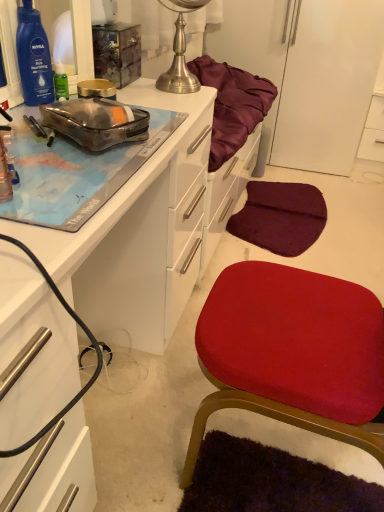
Question: Does white glossy cabinet at upper right, which is counted as the first cabinetry, starting from the back, turn towards matte white desk at upper left, the 1th cabinetry when ordered from bottom to top?

Choices:
 (A) yes
 (B) no

Answer: (B)

Question: From a real-world perspective, is white glossy cabinet at upper right, which is counted as the first cabinetry, starting from the back, on matte white desk at upper left, the second cabinetry from the right?

Choices:
 (A) no
 (B) yes

Answer: (A)

Question: Does white glossy cabinet at upper right, which is counted as the first cabinetry, starting from the back, have a greater width compared to matte white desk at upper left, the first cabinetry from the left?

Choices:
 (A) yes
 (B) no

Answer: (B)

Question: Can you confirm if white glossy cabinet at upper right, marked as the 1th cabinetry in a right-to-left arrangement, is taller than matte white desk at upper left, which is the 2th cabinetry in top-to-bottom order?

Choices:
 (A) no
 (B) yes

Answer: (A)

Question: Can you confirm if white glossy cabinet at upper right, which is counted as the first cabinetry, starting from the back, is bigger than matte white desk at upper left, the first cabinetry from the left?

Choices:
 (A) no
 (B) yes

Answer: (A)

Question: Based on their sizes in the image, would you say white glossy cabinet at upper right, the first cabinetry when ordered from top to bottom, is bigger or smaller than matte white desk at upper left, the 1th cabinetry when ordered from bottom to top?

Choices:
 (A) big
 (B) small

Answer: (B)

Question: From the image's perspective, is white glossy cabinet at upper right, which is counted as the 2th cabinetry, starting from the bottom, above or below matte white desk at upper left, which is the 2th cabinetry in top-to-bottom order?

Choices:
 (A) above
 (B) below

Answer: (A)

Question: Is white glossy cabinet at upper right, positioned as the second cabinetry in front-to-back order, wider or thinner than matte white desk at upper left, the 1th cabinetry when ordered from bottom to top?

Choices:
 (A) wide
 (B) thin

Answer: (B)

Question: Considering the positions of white glossy cabinet at upper right, positioned as the 2th cabinetry in left-to-right order, and matte white desk at upper left, which is the 2th cabinetry in back-to-front order, in the image, is white glossy cabinet at upper right, positioned as the 2th cabinetry in left-to-right order, taller or shorter than matte white desk at upper left, which is the 2th cabinetry in back-to-front order,?

Choices:
 (A) short
 (B) tall

Answer: (A)

Question: Is transparent plastic pouch at upper left to the left or to the right of matte white desk at upper left, the second cabinetry from the right, in the image?

Choices:
 (A) left
 (B) right

Answer: (B)

Question: Is transparent plastic pouch at upper left spatially inside matte white desk at upper left, which is the 2th cabinetry in top-to-bottom order, or outside of it?

Choices:
 (A) inside
 (B) outside

Answer: (B)

Question: Does point (76, 109) appear closer or farther from the camera than point (51, 486)?

Choices:
 (A) farther
 (B) closer

Answer: (A)

Question: Considering their positions, is transparent plastic pouch at upper left located in front of or behind matte white desk at upper left, which is counted as the first cabinetry, starting from the front?

Choices:
 (A) behind
 (B) front

Answer: (A)

Question: Is brushed metal globe at upper center taller or shorter than transparent plastic pouch at upper left?

Choices:
 (A) tall
 (B) short

Answer: (A)

Question: Is brushed metal globe at upper center to the left or to the right of transparent plastic pouch at upper left in the image?

Choices:
 (A) right
 (B) left

Answer: (A)